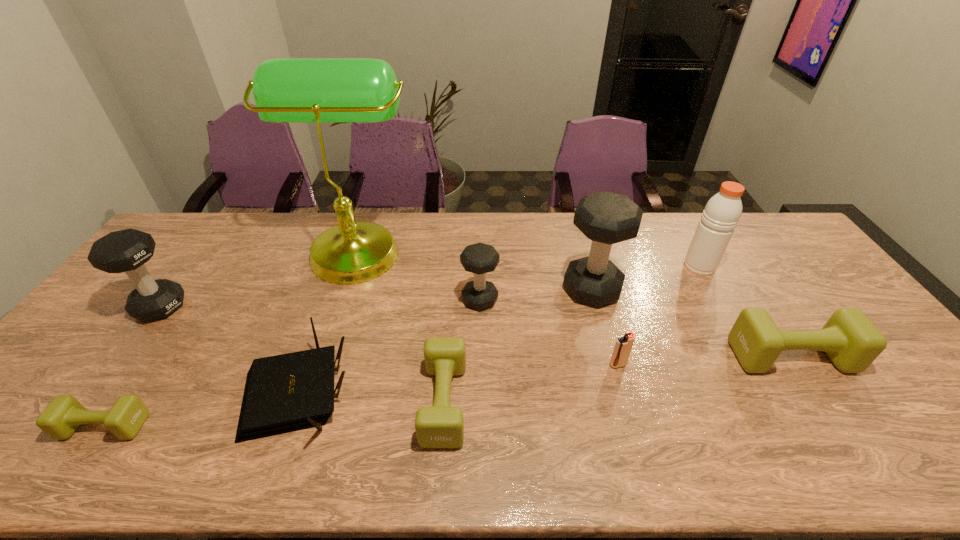
What are the coordinates of `vacant point located between the orange shaker and the rightmost gray dumbbell` in the screenshot? It's located at (646, 278).

I want to click on empty space between the leftmost olive dumbbell and the orange shaker, so click(x=402, y=346).

You are a GUI agent. You are given a task and a screenshot of the screen. Output one action in this format:
    pyautogui.click(x=<x>, y=<y>)
    Task: Click on the vacant point located between the second olive dumbbell from right to left and the red igniter
    Image resolution: width=960 pixels, height=540 pixels.
    Given the screenshot: What is the action you would take?
    pyautogui.click(x=531, y=383)

Identify the location of free spot between the second smallest olive dumbbell and the shaker. (572, 334).

Identify which object is the fifth closest to the fourth tallest object. Please provide its 2D coordinates. Your answer should be formatted as a tuple, i.e. [(x, y)], where the tuple contains the x and y coordinates of a point satisfying the conditions above.

[(479, 258)]

Locate which object is the closest to the second biggest olive dumbbell. Please provide its 2D coordinates. Your answer should be formatted as a tuple, i.e. [(x, y)], where the tuple contains the x and y coordinates of a point satisfying the conditions above.

[(284, 393)]

Where is `the fifth closest dumbbell to the router`? the fifth closest dumbbell to the router is located at coordinates (606, 218).

Where is `dumbbell that stands as the second closest to the tallest object`? The image size is (960, 540). dumbbell that stands as the second closest to the tallest object is located at coordinates (128, 250).

Where is `gray dumbbell that is the second closest to the fourth shortest dumbbell`? The width and height of the screenshot is (960, 540). gray dumbbell that is the second closest to the fourth shortest dumbbell is located at coordinates [128, 250].

Find the location of a particular element. This screenshot has height=540, width=960. gray dumbbell that is the third closest to the second biggest olive dumbbell is located at coordinates (128, 250).